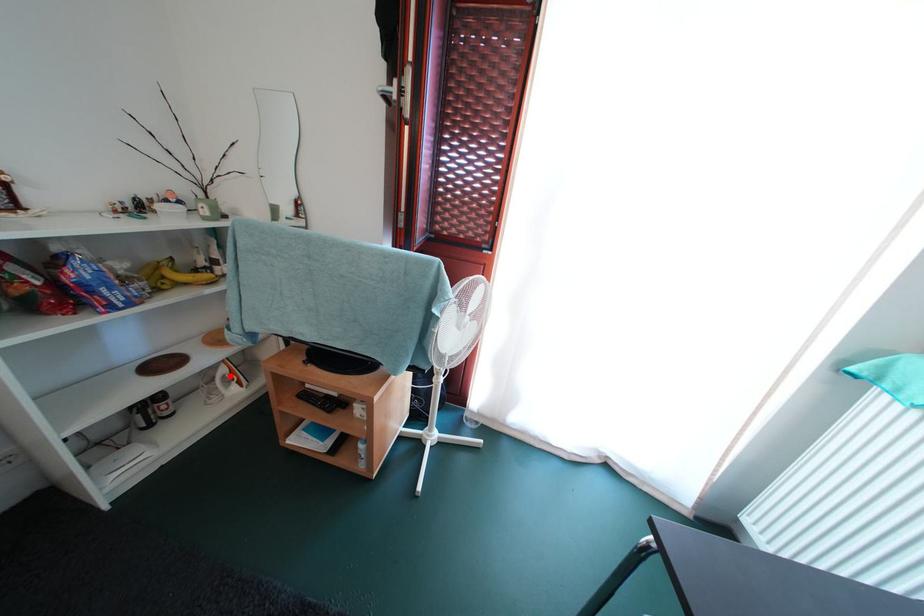
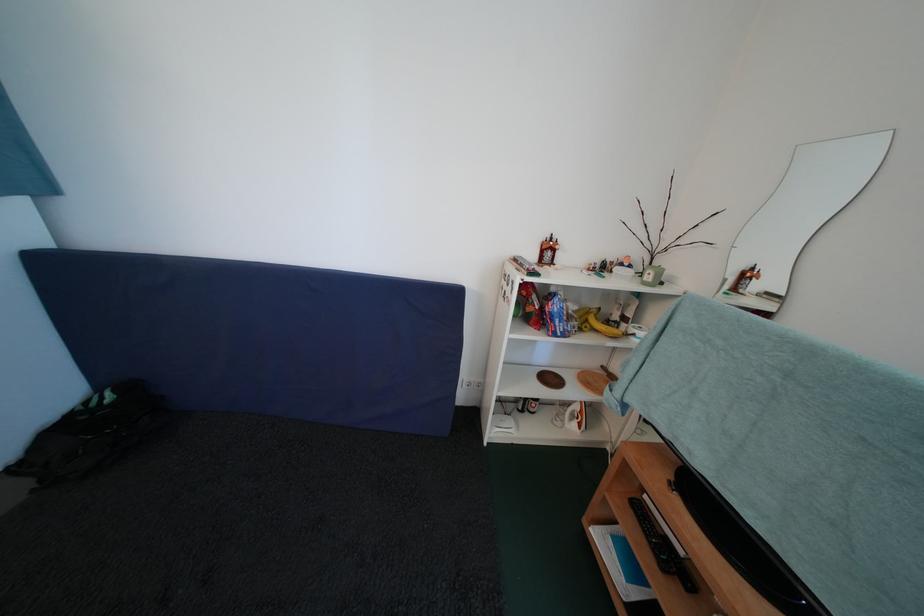
Question: I am providing you with two images of the same scene from different viewpoints. A red point is marked on the first image. Can you still see the location of the red point in image 2?

Choices:
 (A) Yes
 (B) No

Answer: (A)